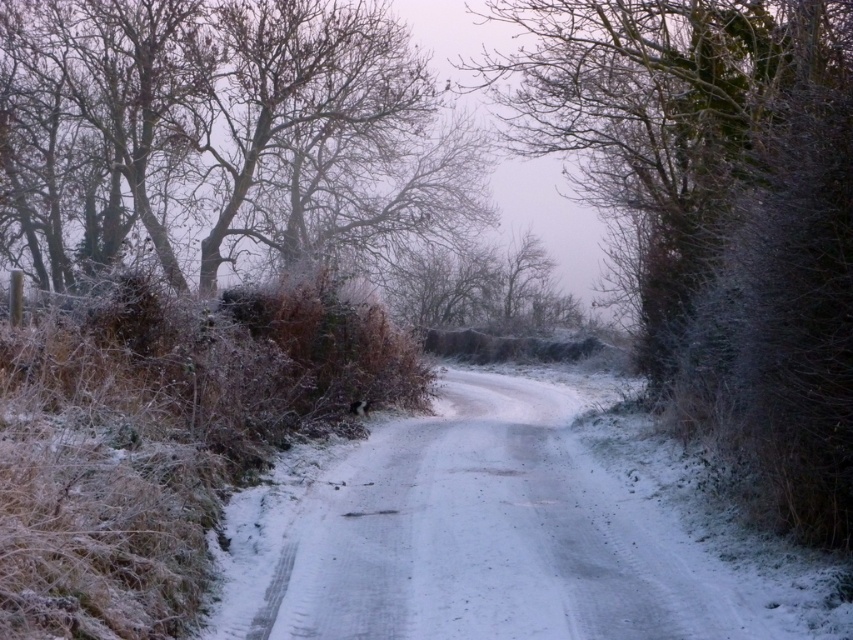
Who is higher up, frosty bark tree at center or snow-covered branches at upper left?

snow-covered branches at upper left

Can you confirm if frosty bark tree at center is wider than snow-covered branches at upper left?

Incorrect, frosty bark tree at center's width does not surpass snow-covered branches at upper left's.

Which is in front, point (804, 58) or point (373, 118)?

Point (804, 58) is in front.

Locate an element on the screen. frosty bark tree at center is located at coordinates (718, 211).